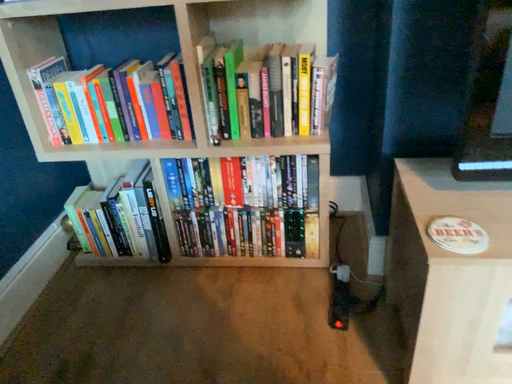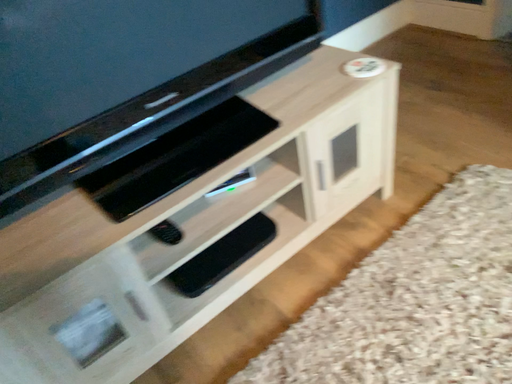
Question: How did the camera likely rotate when shooting the video?

Choices:
 (A) rotated upward
 (B) rotated downward

Answer: (A)